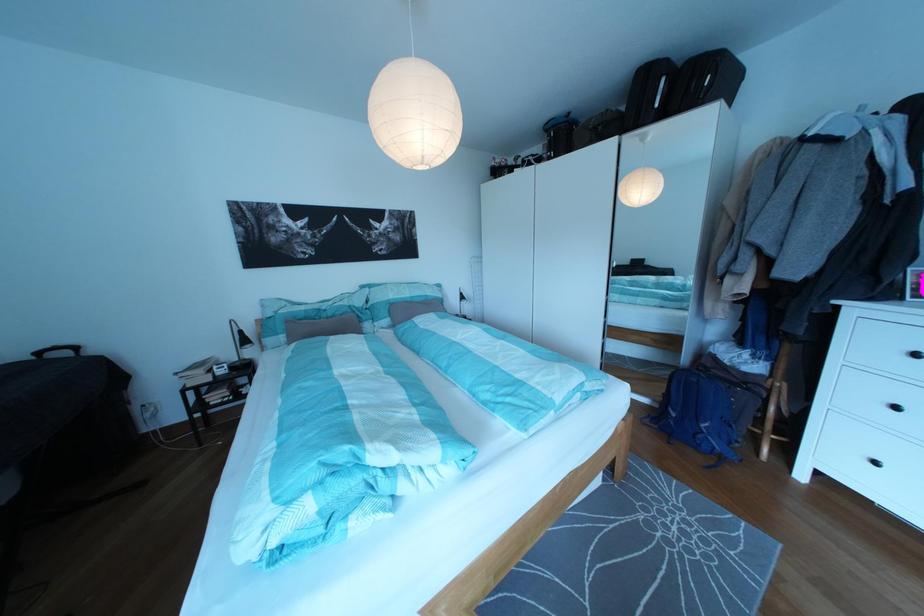
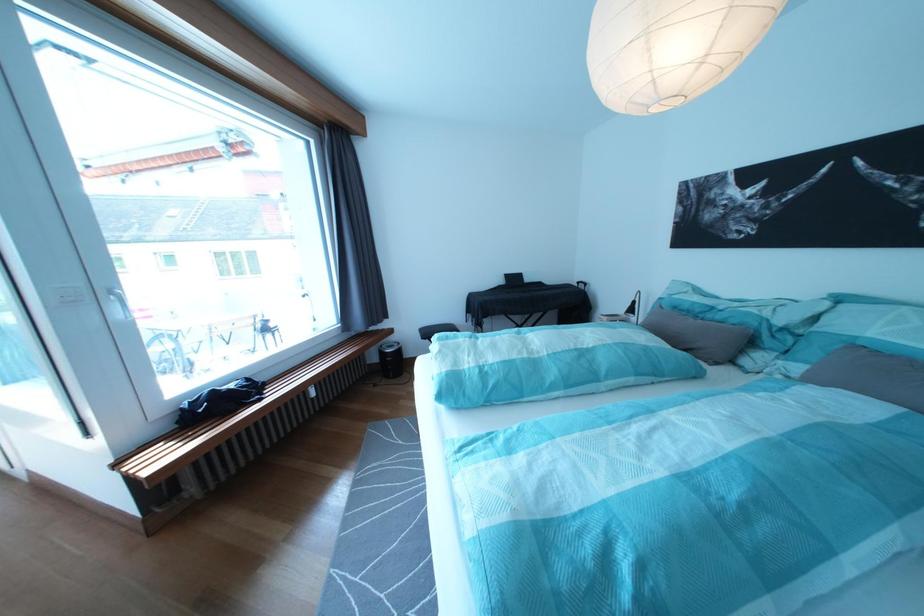
Where in the second image is the point corresponding to (430,424) from the first image?

(480, 373)